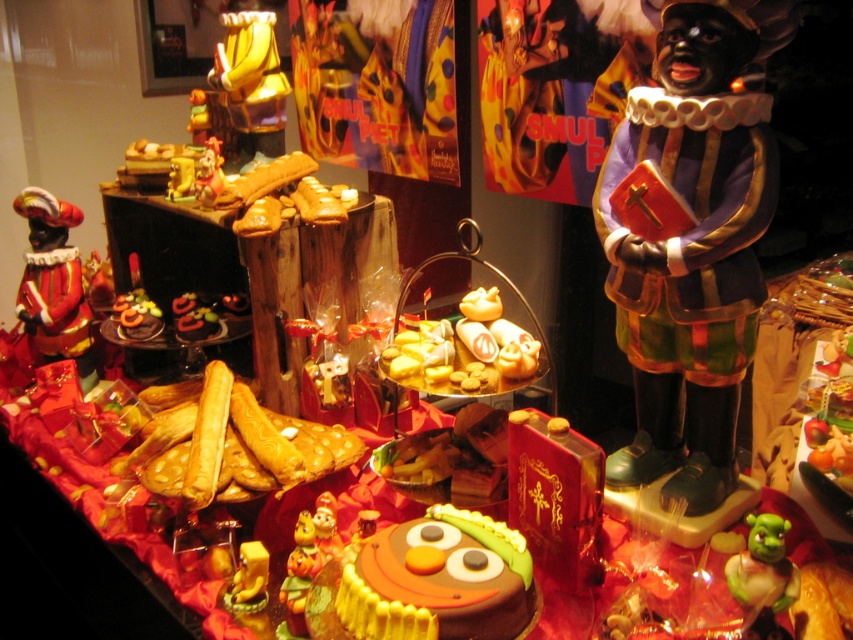
Identify the location of chocolate cake at center. (439, 580).

Can you confirm if chocolate cake at center is positioned to the left of matte gold figurine at upper left?

Incorrect, chocolate cake at center is not on the left side of matte gold figurine at upper left.

Which is behind, point (373, 584) or point (219, 164)?

Point (219, 164)

Where is `chocolate cake at center`? The image size is (853, 640). chocolate cake at center is located at coordinates (439, 580).

Between shiny purple figurine at center and shiny gold figurine at upper left, which one is positioned higher?

Positioned higher is shiny gold figurine at upper left.

Does shiny purple figurine at center have a larger size compared to shiny gold figurine at upper left?

Indeed, shiny purple figurine at center has a larger size compared to shiny gold figurine at upper left.

At what (x,y) coordinates should I click in order to perform the action: click on shiny purple figurine at center. Please return your answer as a coordinate pair (x, y). The width and height of the screenshot is (853, 640). Looking at the image, I should click on (691, 250).

Find the location of a particular element. The image size is (853, 640). shiny purple figurine at center is located at coordinates (691, 250).

Does point (36, 216) lie behind point (193, 182)?

Yes.

Based on the photo, can you confirm if matte red wood figure at left is thinner than matte gold figurine at upper left?

No.

Describe the element at coordinates (54, 284) in the screenshot. The width and height of the screenshot is (853, 640). I see `matte red wood figure at left` at that location.

Find the location of a particular element. The width and height of the screenshot is (853, 640). matte red wood figure at left is located at coordinates (54, 284).